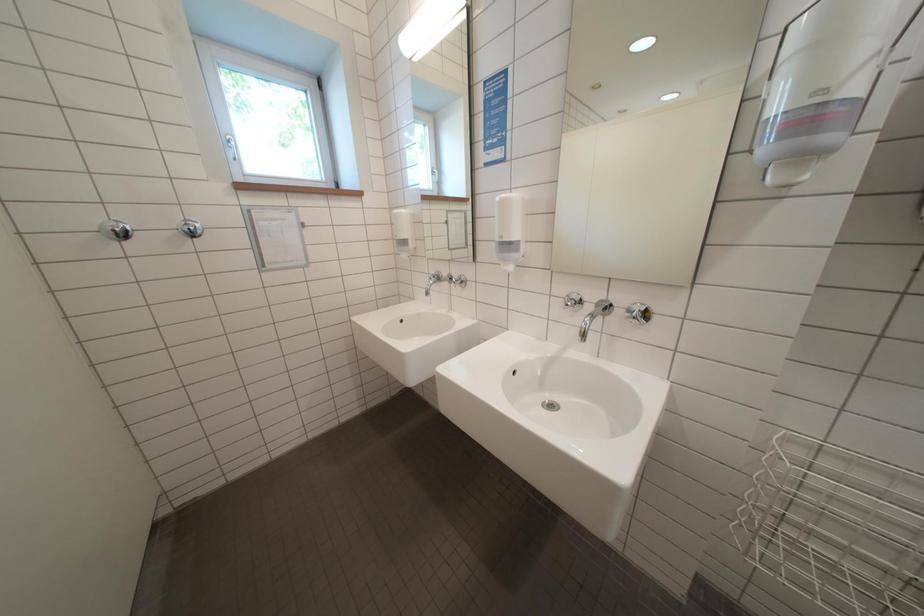
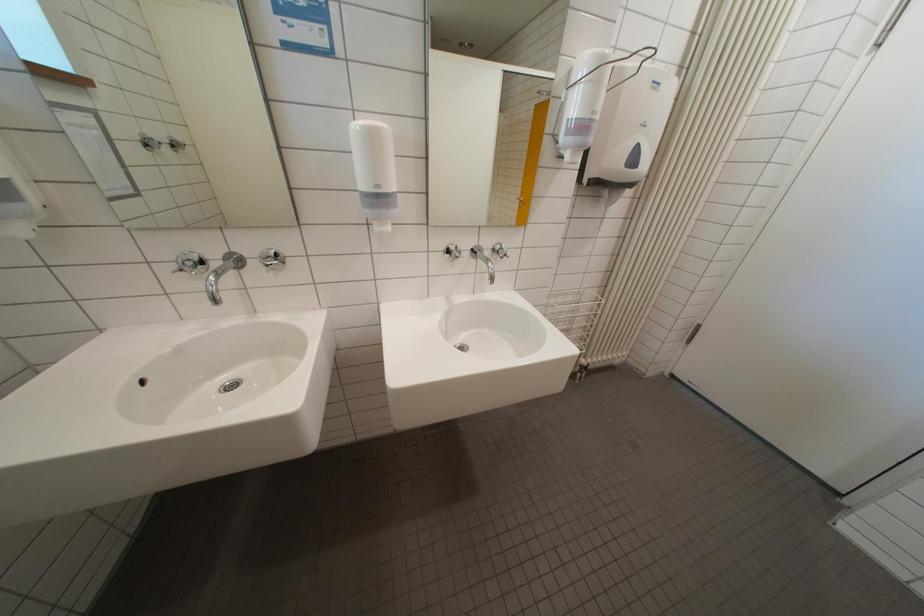
First-person continuous shooting, in which direction is the camera rotating?

The camera's rotation is toward right-down.